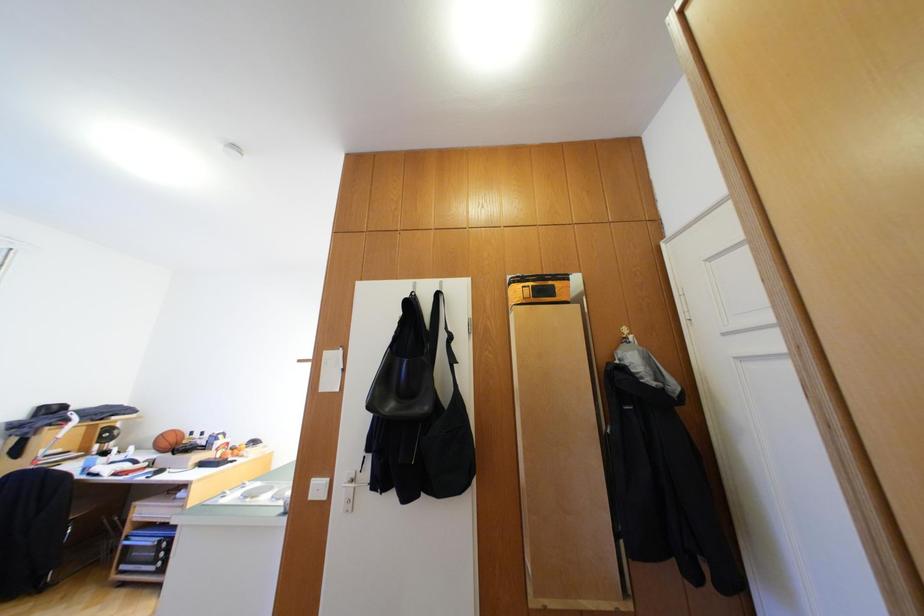
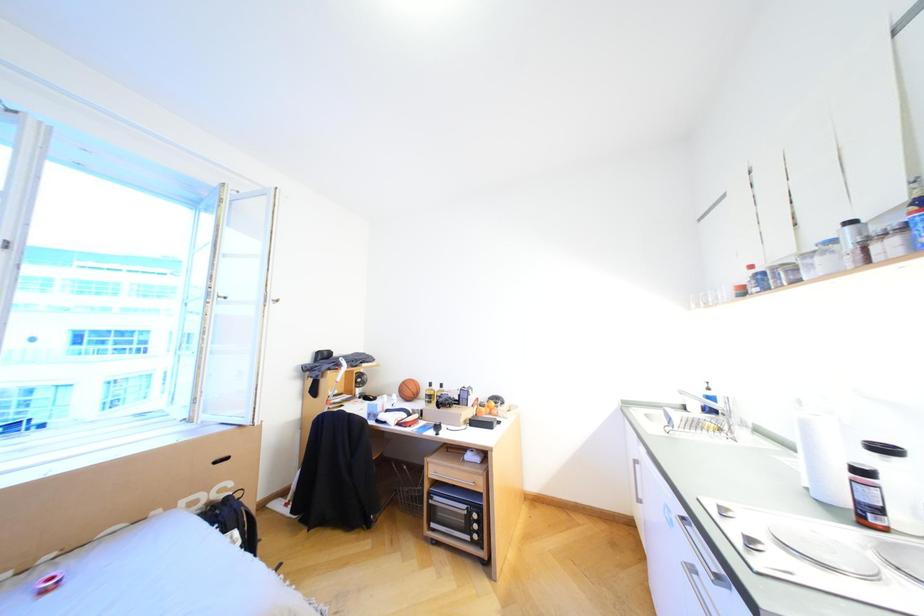
The images are taken continuously from a first-person perspective. In which direction are you moving?

The movement direction of the cameraman is left, forward.